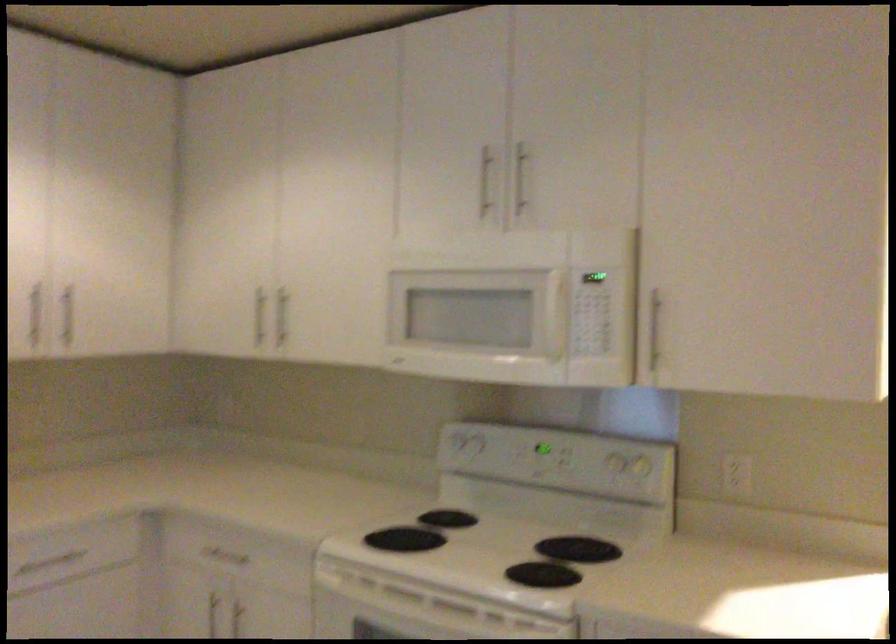
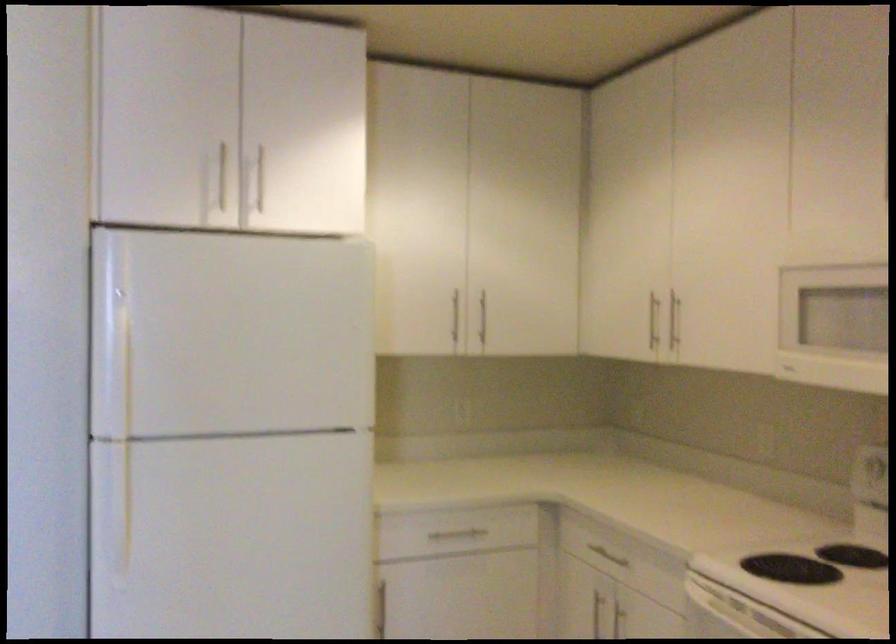
In the second image, find the point that corresponds to point 70,315 in the first image.

(483, 317)